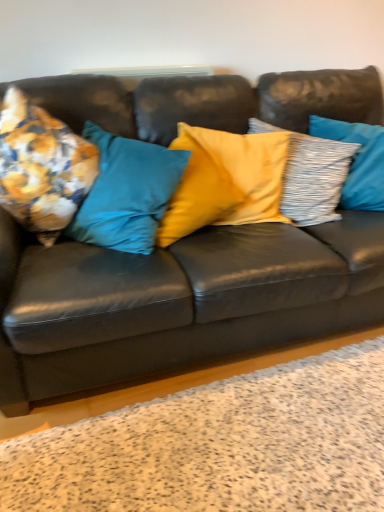
Question: Is yellow satin pillow at center, the second pillow positioned from the right, taller than floral fabric cushion at left, the 2th pillow from the left?

Choices:
 (A) no
 (B) yes

Answer: (B)

Question: From the image's perspective, is yellow satin pillow at center, arranged as the 3th pillow when viewed from the left, above floral fabric cushion at left, the 2th pillow from the left?

Choices:
 (A) yes
 (B) no

Answer: (A)

Question: Considering the relative sizes of yellow satin pillow at center, arranged as the 3th pillow when viewed from the left, and floral fabric cushion at left, the 2th pillow from the left, in the image provided, is yellow satin pillow at center, arranged as the 3th pillow when viewed from the left, shorter than floral fabric cushion at left, the 2th pillow from the left,?

Choices:
 (A) no
 (B) yes

Answer: (A)

Question: Is yellow satin pillow at center, the second pillow positioned from the right, facing towards floral fabric cushion at left, the 3th pillow positioned from the right?

Choices:
 (A) yes
 (B) no

Answer: (B)

Question: Does yellow satin pillow at center, the second pillow positioned from the right, lie in front of floral fabric cushion at left, the 3th pillow positioned from the right?

Choices:
 (A) no
 (B) yes

Answer: (A)

Question: Can you confirm if yellow satin pillow at center, arranged as the 3th pillow when viewed from the left, is bigger than floral fabric cushion at left, the 3th pillow positioned from the right?

Choices:
 (A) yes
 (B) no

Answer: (A)

Question: Is textured gray pillow at right, the fourth pillow positioned from the left, completely or partially inside yellow satin pillow at center, arranged as the 3th pillow when viewed from the left?

Choices:
 (A) no
 (B) yes

Answer: (B)

Question: Considering the relative sizes of yellow satin pillow at center, arranged as the 3th pillow when viewed from the left, and textured gray pillow at right, marked as the first pillow in a right-to-left arrangement, in the image provided, is yellow satin pillow at center, arranged as the 3th pillow when viewed from the left, taller than textured gray pillow at right, marked as the first pillow in a right-to-left arrangement,?

Choices:
 (A) yes
 (B) no

Answer: (A)

Question: Does yellow satin pillow at center, the second pillow positioned from the right, have a smaller size compared to textured gray pillow at right, marked as the first pillow in a right-to-left arrangement?

Choices:
 (A) yes
 (B) no

Answer: (B)

Question: From the image's perspective, is yellow satin pillow at center, arranged as the 3th pillow when viewed from the left, located above textured gray pillow at right, the fourth pillow positioned from the left?

Choices:
 (A) yes
 (B) no

Answer: (B)

Question: From a real-world perspective, is yellow satin pillow at center, the second pillow positioned from the right, physically above textured gray pillow at right, the fourth pillow positioned from the left?

Choices:
 (A) yes
 (B) no

Answer: (B)

Question: Considering the relative sizes of yellow satin pillow at center, arranged as the 3th pillow when viewed from the left, and textured gray pillow at right, marked as the first pillow in a right-to-left arrangement, in the image provided, is yellow satin pillow at center, arranged as the 3th pillow when viewed from the left, thinner than textured gray pillow at right, marked as the first pillow in a right-to-left arrangement,?

Choices:
 (A) yes
 (B) no

Answer: (A)

Question: From a real-world perspective, is matte black couch at center positioned under textured gray pillow at right, marked as the first pillow in a right-to-left arrangement, based on gravity?

Choices:
 (A) yes
 (B) no

Answer: (A)